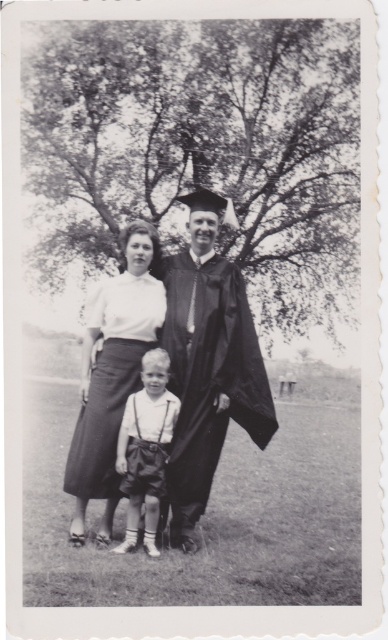
Between matte black graduation gown at center and smooth white shirt at center, which one appears on the right side from the viewer's perspective?

matte black graduation gown at center is more to the right.

Between point (185, 550) and point (136, 440), which one is positioned behind?

The point (136, 440) is more distant.

Is point (239, 320) closer to camera compared to point (162, 448)?

No, (239, 320) is behind (162, 448).

I want to click on matte black graduation gown at center, so click(x=207, y=365).

Between matte black graduation gown at center and matte white blouse at center, which one has less height?

Standing shorter between the two is matte white blouse at center.

Is matte black graduation gown at center wider than matte white blouse at center?

Indeed, matte black graduation gown at center has a greater width compared to matte white blouse at center.

Describe the element at coordinates (207, 365) in the screenshot. I see `matte black graduation gown at center` at that location.

Image resolution: width=388 pixels, height=640 pixels. I want to click on matte black graduation gown at center, so click(207, 365).

Is the position of matte white blouse at center less distant than that of smooth white shirt at center?

No, matte white blouse at center is further to the viewer.

Can you confirm if matte white blouse at center is smaller than smooth white shirt at center?

Incorrect, matte white blouse at center is not smaller in size than smooth white shirt at center.

What do you see at coordinates (112, 372) in the screenshot? I see `matte white blouse at center` at bounding box center [112, 372].

Locate an element on the screen. matte white blouse at center is located at coordinates (112, 372).